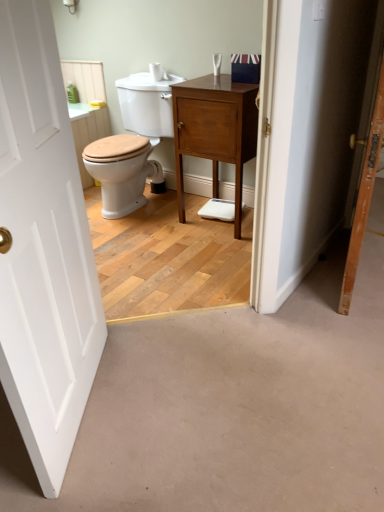
Question: Considering the relative sizes of white wooden door at left, which is counted as the second door, starting from the right, and matte wood nightstand at center in the image provided, is white wooden door at left, which is counted as the second door, starting from the right, wider than matte wood nightstand at center?

Choices:
 (A) no
 (B) yes

Answer: (A)

Question: Is white wooden door at left, marked as the 1th door in a left-to-right arrangement, outside matte wood nightstand at center?

Choices:
 (A) no
 (B) yes

Answer: (B)

Question: Can you confirm if white wooden door at left, marked as the 1th door in a left-to-right arrangement, is bigger than matte wood nightstand at center?

Choices:
 (A) yes
 (B) no

Answer: (B)

Question: Is white wooden door at left, marked as the 1th door in a left-to-right arrangement, facing away from matte wood nightstand at center?

Choices:
 (A) yes
 (B) no

Answer: (B)

Question: Can you confirm if white wooden door at left, marked as the 1th door in a left-to-right arrangement, is thinner than matte wood nightstand at center?

Choices:
 (A) yes
 (B) no

Answer: (A)

Question: In terms of height, does matte wood nightstand at center look taller or shorter compared to white wooden door at left, which is counted as the second door, starting from the right?

Choices:
 (A) short
 (B) tall

Answer: (A)

Question: From the image's perspective, is matte wood nightstand at center above or below white wooden door at left, marked as the 1th door in a left-to-right arrangement?

Choices:
 (A) below
 (B) above

Answer: (B)

Question: Choose the correct answer: Is matte wood nightstand at center inside white wooden door at left, marked as the 1th door in a left-to-right arrangement, or outside it?

Choices:
 (A) outside
 (B) inside

Answer: (A)

Question: Would you say matte wood nightstand at center is to the left or to the right of white wooden door at left, marked as the 1th door in a left-to-right arrangement, in the picture?

Choices:
 (A) right
 (B) left

Answer: (A)

Question: In terms of width, does white wooden door at left, marked as the 1th door in a left-to-right arrangement, look wider or thinner when compared to wooden door at right, acting as the 1th door starting from the right?

Choices:
 (A) wide
 (B) thin

Answer: (A)

Question: Considering the positions of point (104, 332) and point (342, 286), is point (104, 332) closer or farther from the camera than point (342, 286)?

Choices:
 (A) farther
 (B) closer

Answer: (B)

Question: Considering the positions of white wooden door at left, marked as the 1th door in a left-to-right arrangement, and wooden door at right, acting as the 1th door starting from the right, in the image, is white wooden door at left, marked as the 1th door in a left-to-right arrangement, taller or shorter than wooden door at right, acting as the 1th door starting from the right,?

Choices:
 (A) short
 (B) tall

Answer: (B)

Question: Considering their positions, is white wooden door at left, marked as the 1th door in a left-to-right arrangement, located in front of or behind wooden door at right, the second door in the left-to-right sequence?

Choices:
 (A) behind
 (B) front

Answer: (B)

Question: Looking at their shapes, would you say wooden door at right, the second door in the left-to-right sequence, is wider or thinner than matte wood nightstand at center?

Choices:
 (A) wide
 (B) thin

Answer: (B)

Question: Considering their positions, is wooden door at right, acting as the 1th door starting from the right, located in front of or behind matte wood nightstand at center?

Choices:
 (A) behind
 (B) front

Answer: (B)